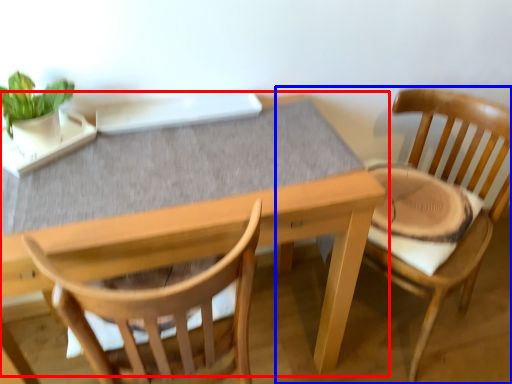
Question: Which of the following is the closest to the observer, table (highlighted by a red box) or chair (highlighted by a blue box)?

Choices:
 (A) table
 (B) chair

Answer: (A)